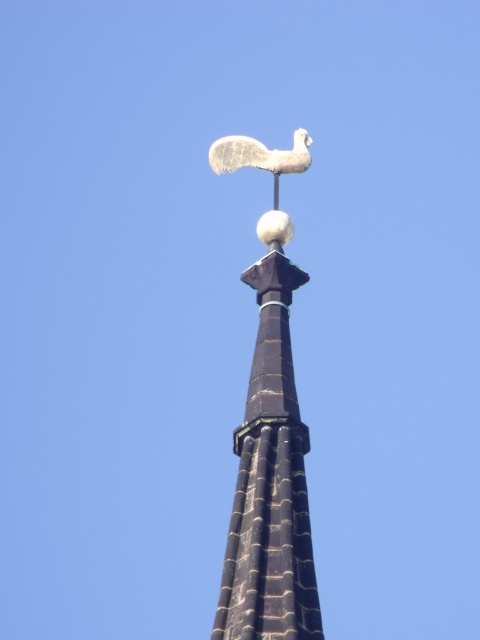
Does black stone spire at upper center have a smaller size compared to white stone bird at upper center?

Yes.

The height and width of the screenshot is (640, 480). Describe the element at coordinates (269, 483) in the screenshot. I see `black stone spire at upper center` at that location.

The image size is (480, 640). What do you see at coordinates (269, 483) in the screenshot? I see `black stone spire at upper center` at bounding box center [269, 483].

The height and width of the screenshot is (640, 480). I want to click on black stone spire at upper center, so click(x=269, y=483).